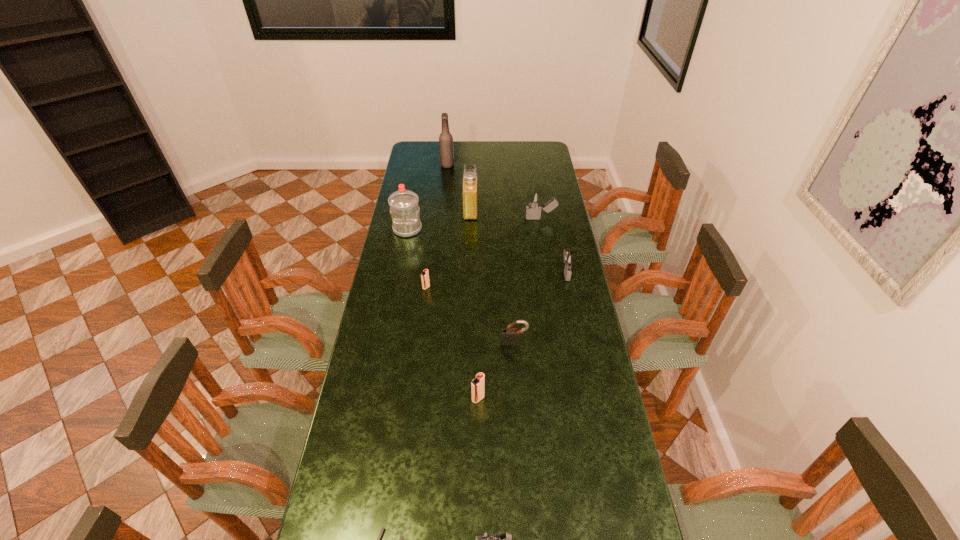
At what (x,y) coordinates should I click in order to perform the action: click on free space located 0.060m on the front of the sixth farthest object. Please return your answer as a coordinate pair (x, y). The width and height of the screenshot is (960, 540). Looking at the image, I should click on (424, 301).

At what (x,y) coordinates should I click in order to perform the action: click on object at the far edge. Please return your answer as a coordinate pair (x, y). Looking at the image, I should click on (445, 139).

Where is `object situated at the left edge`? The width and height of the screenshot is (960, 540). object situated at the left edge is located at coordinates (404, 208).

Image resolution: width=960 pixels, height=540 pixels. I want to click on vacant position at the far edge of the desktop, so click(454, 152).

Where is `vacant space at the left edge of the desktop`? This screenshot has width=960, height=540. vacant space at the left edge of the desktop is located at coordinates (370, 507).

Identify the location of free location at the right edge. (557, 306).

I want to click on vacant space that is in between the left red igniter and the eighth farthest object, so click(452, 343).

Where is `free space between the second farthest igniter and the padlock`? The width and height of the screenshot is (960, 540). free space between the second farthest igniter and the padlock is located at coordinates (540, 307).

Locate an element on the screen. vacant space that is in between the white water bottle and the farthest object is located at coordinates (427, 197).

You are a GUI agent. You are given a task and a screenshot of the screen. Output one action in this format:
    pyautogui.click(x=<x>, y=<y>)
    Task: Click on the vacant space that's between the second farthest igniter and the water bottle
    The height and width of the screenshot is (540, 960).
    Given the screenshot: What is the action you would take?
    pyautogui.click(x=487, y=251)